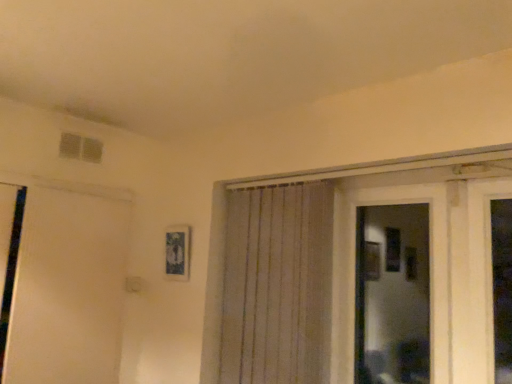
Question: Is white textured curtain at center outside of transparent glass door at center?

Choices:
 (A) no
 (B) yes

Answer: (B)

Question: From the image's perspective, would you say white textured curtain at center is shown under transparent glass door at center?

Choices:
 (A) no
 (B) yes

Answer: (B)

Question: Does white textured curtain at center appear on the left side of transparent glass door at center?

Choices:
 (A) no
 (B) yes

Answer: (B)

Question: Are white textured curtain at center and transparent glass door at center located far from each other?

Choices:
 (A) no
 (B) yes

Answer: (B)

Question: Can you confirm if white textured curtain at center is taller than transparent glass door at center?

Choices:
 (A) no
 (B) yes

Answer: (B)

Question: From their relative heights in the image, would you say white matte door at left is taller or shorter than transparent glass door at center?

Choices:
 (A) tall
 (B) short

Answer: (A)

Question: Is white matte door at left in front of or behind transparent glass door at center in the image?

Choices:
 (A) front
 (B) behind

Answer: (B)

Question: Considering the positions of white matte door at left and transparent glass door at center in the image, is white matte door at left bigger or smaller than transparent glass door at center?

Choices:
 (A) small
 (B) big

Answer: (B)

Question: Based on their positions, is white matte door at left located to the left or right of transparent glass door at center?

Choices:
 (A) left
 (B) right

Answer: (A)

Question: In terms of width, does white textured curtain at center look wider or thinner when compared to white matte door at left?

Choices:
 (A) thin
 (B) wide

Answer: (A)

Question: From a real-world perspective, is white textured curtain at center physically located above or below white matte door at left?

Choices:
 (A) above
 (B) below

Answer: (A)

Question: Is point (276, 372) positioned closer to the camera than point (76, 256)?

Choices:
 (A) closer
 (B) farther

Answer: (A)

Question: Is white textured curtain at center in front of or behind white matte door at left in the image?

Choices:
 (A) behind
 (B) front

Answer: (B)

Question: Is transparent glass door at center situated inside white matte door at left or outside?

Choices:
 (A) outside
 (B) inside

Answer: (A)

Question: Looking at their shapes, would you say transparent glass door at center is wider or thinner than white matte door at left?

Choices:
 (A) wide
 (B) thin

Answer: (B)